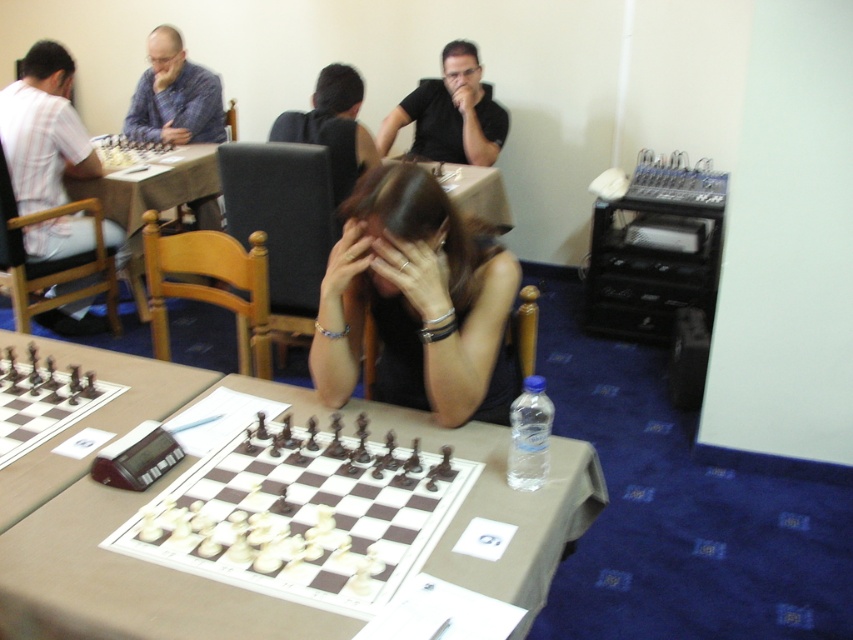
Which of these two, white plastic chessboard at center or black fabric hair at center, stands taller?

black fabric hair at center is taller.

Does white plastic chessboard at center come behind black fabric hair at center?

No, white plastic chessboard at center is closer to the viewer.

Who is more forward, (346, 598) or (405, 262)?

Point (346, 598)

Find the location of `white plastic chessboard at center`. white plastic chessboard at center is located at coordinates (300, 518).

Is black matte shirt at upper center to the right of black hair at center from the viewer's perspective?

Indeed, black matte shirt at upper center is positioned on the right side of black hair at center.

Can you confirm if black matte shirt at upper center is wider than black hair at center?

Yes.

Image resolution: width=853 pixels, height=640 pixels. Find the location of `black matte shirt at upper center`. black matte shirt at upper center is located at coordinates (450, 113).

Find the location of a particular element. The width and height of the screenshot is (853, 640). black matte shirt at upper center is located at coordinates point(450,113).

Does brown wooden table at center have a larger size compared to black hair at center?

Result: Yes, brown wooden table at center is bigger than black hair at center.

Between brown wooden table at center and black hair at center, which one appears on the left side from the viewer's perspective?

brown wooden table at center

Is point (7, 604) in front of point (358, 172)?

That is True.

You are a GUI agent. You are given a task and a screenshot of the screen. Output one action in this format:
    pyautogui.click(x=<x>, y=<y>)
    Task: Click on the brown wooden table at center
    This screenshot has width=853, height=640.
    Given the screenshot: What is the action you would take?
    pyautogui.click(x=122, y=522)